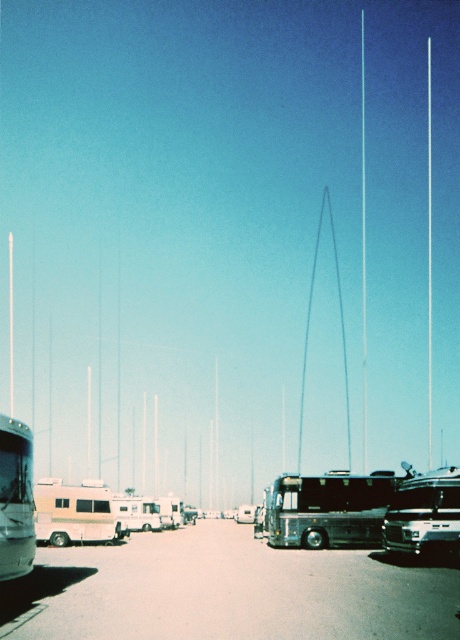
Does point (23, 512) come farther from viewer compared to point (247, 513)?

No, it is in front of (247, 513).

Is metallic silver bus at left to the right of metallic silver car at center from the viewer's perspective?

No, metallic silver bus at left is not to the right of metallic silver car at center.

What do you see at coordinates (16, 499) in the screenshot? I see `metallic silver bus at left` at bounding box center [16, 499].

This screenshot has height=640, width=460. I want to click on metallic silver bus at left, so click(x=16, y=499).

Consider the image. Which is above, metallic silver bus at center or metallic silver car at center?

metallic silver bus at center is above.

Is metallic silver bus at center above metallic silver car at center?

Yes.

This screenshot has height=640, width=460. I want to click on metallic silver bus at center, so click(x=225, y=592).

Which is in front, point (168, 502) or point (252, 518)?

Positioned in front is point (168, 502).

Does silver metallic bus at center have a greater height compared to metallic silver car at center?

Yes.

Who is more forward, [172,516] or [241,518]?

Point [172,516] is more forward.

Locate an element on the screen. This screenshot has width=460, height=640. silver metallic bus at center is located at coordinates point(170,512).